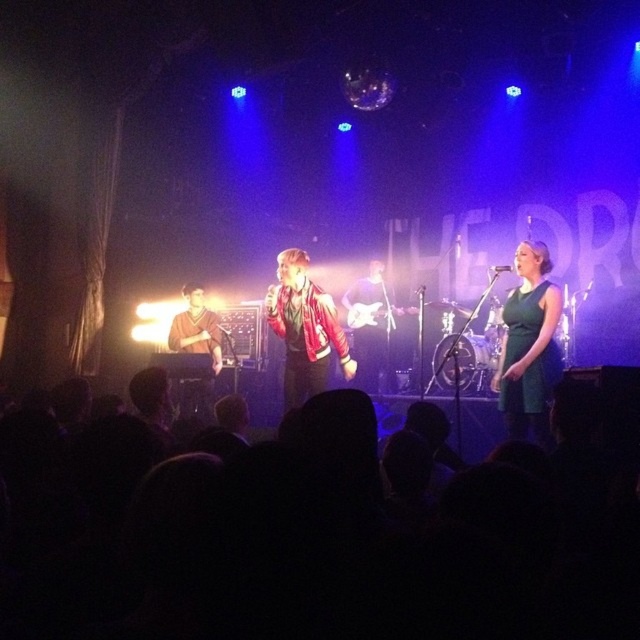
You are a photographer at the back of the venue. You want to take a photo of both the green satin dress at center and the shiny red jacket at center. Based on their positions, which one is closer to you?

The green satin dress at center is in front of the shiny red jacket at center, so the green satin dress at center is closer to you.

You are standing at the point marked as point (538, 310) in the image. The lead singer with the red jacket is 4.10 meters away from you. If you want to move closer to the lead singer with the red jacket, which direction should you move?

Since the lead singer with the red jacket is 4.10 meters away from point (538, 310), you should move towards the direction where the distance decreases, which would be towards the lead singer with the red jacket.